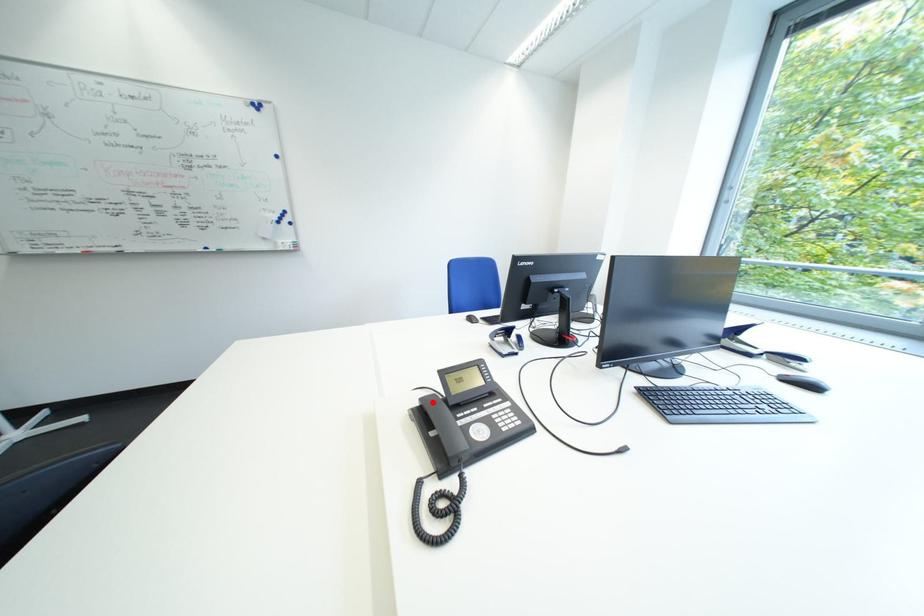
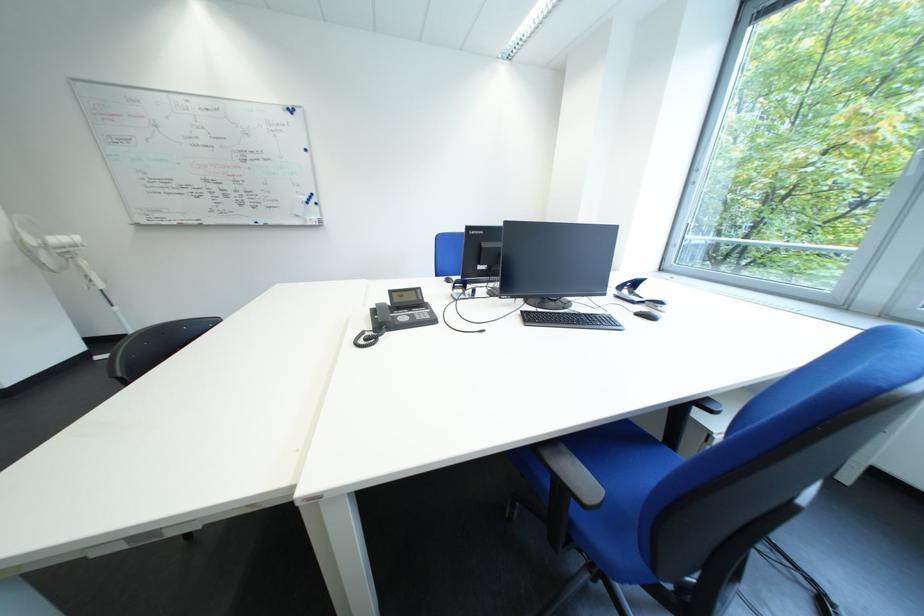
Where in the second image is the point corresponding to the highlighted location from the first image?

(388, 307)